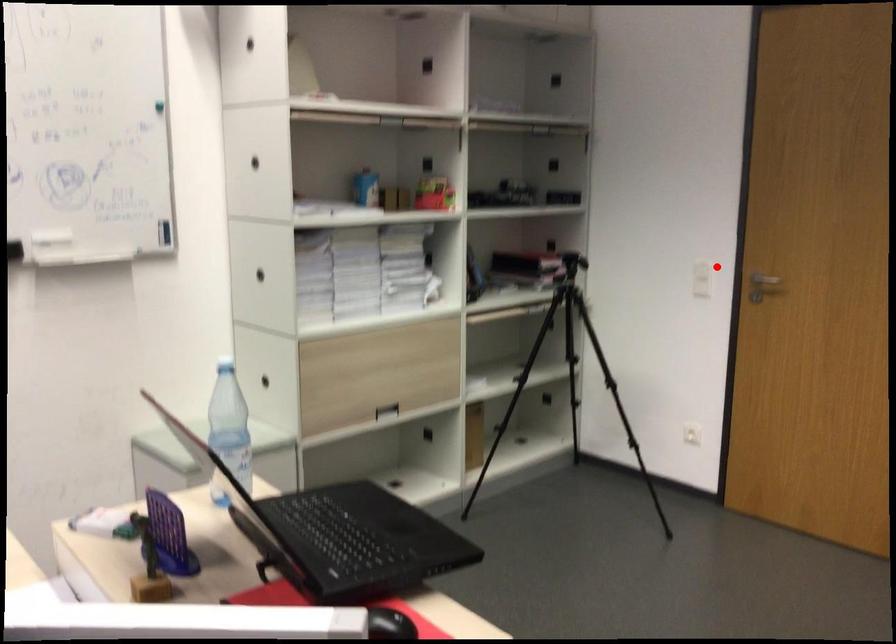
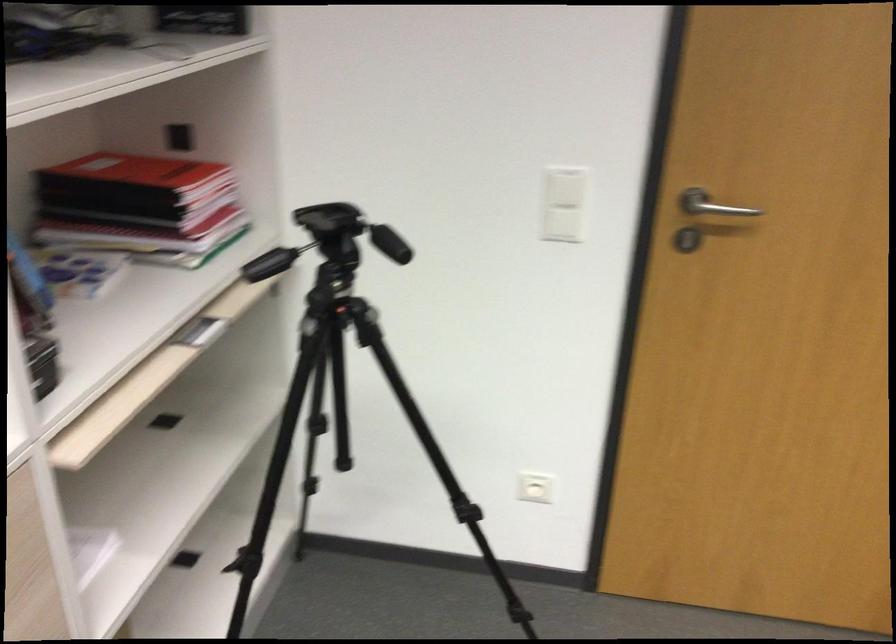
Question: I am providing you with two images of the same scene from different viewpoints. A red point is marked on the first image. Is the red point's position out of view in image 2?

Choices:
 (A) Yes
 (B) No

Answer: (B)